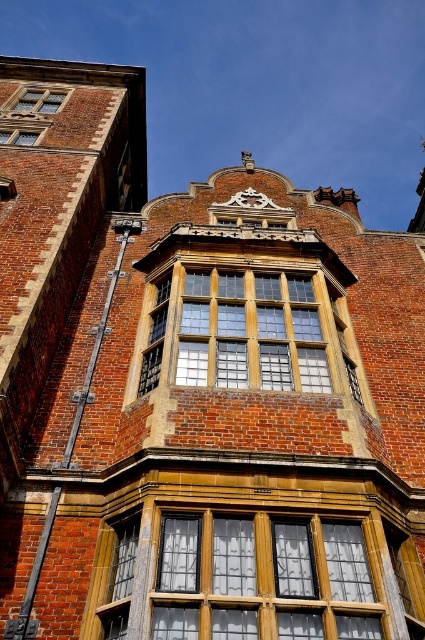
Can you confirm if clear glass windows at center is positioned above wooden textured window at center?

Actually, clear glass windows at center is below wooden textured window at center.

Locate an element on the screen. This screenshot has height=640, width=425. clear glass windows at center is located at coordinates (243, 577).

Who is more forward, (316, 518) or (51, 104)?

Point (316, 518)

Where is `clear glass windows at center`? clear glass windows at center is located at coordinates (243, 577).

Is point (232, 586) closer to viewer compared to point (47, 92)?

Yes, point (232, 586) is closer to viewer.

This screenshot has width=425, height=640. I want to click on clear glass windows at center, so click(x=243, y=577).

Is clear glass window at upper left positioned in front of matte glass window at upper left?

No, it is not.

From the picture: Who is more distant from viewer, (31, 104) or (8, 140)?

Point (31, 104)

Is point (51, 92) positioned in front of point (30, 145)?

No, it is behind (30, 145).

Identify the location of clear glass window at upper left. (39, 100).